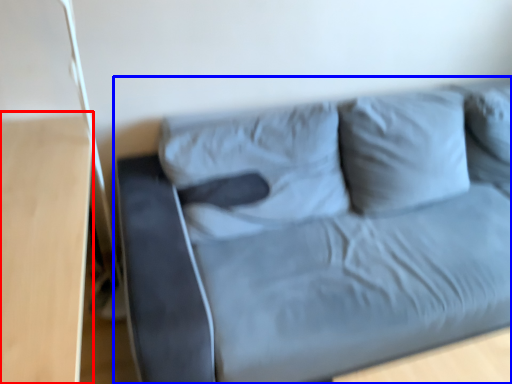
Question: Which object is further to the camera taking this photo, table (highlighted by a red box) or studio couch (highlighted by a blue box)?

Choices:
 (A) table
 (B) studio couch

Answer: (B)